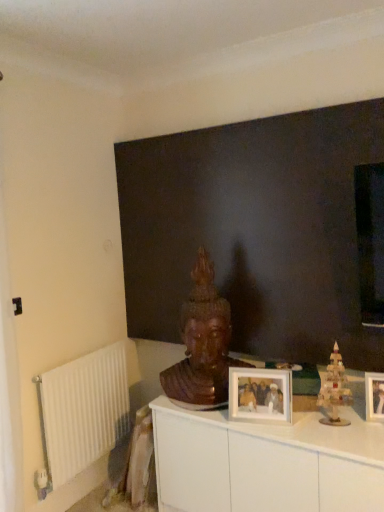
Find the location of `vacant area that is in front of wooden christmas tree at right`. vacant area that is in front of wooden christmas tree at right is located at coordinates (347, 437).